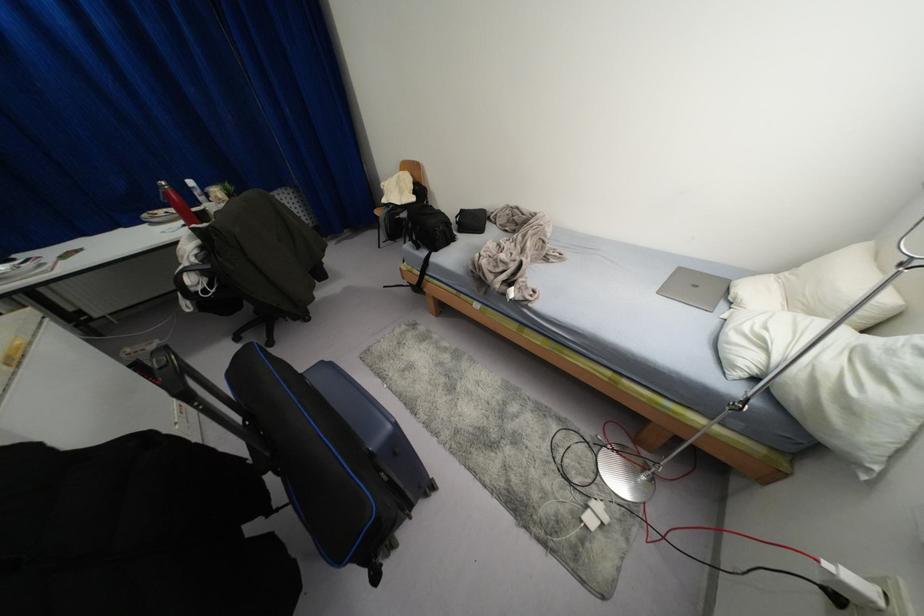
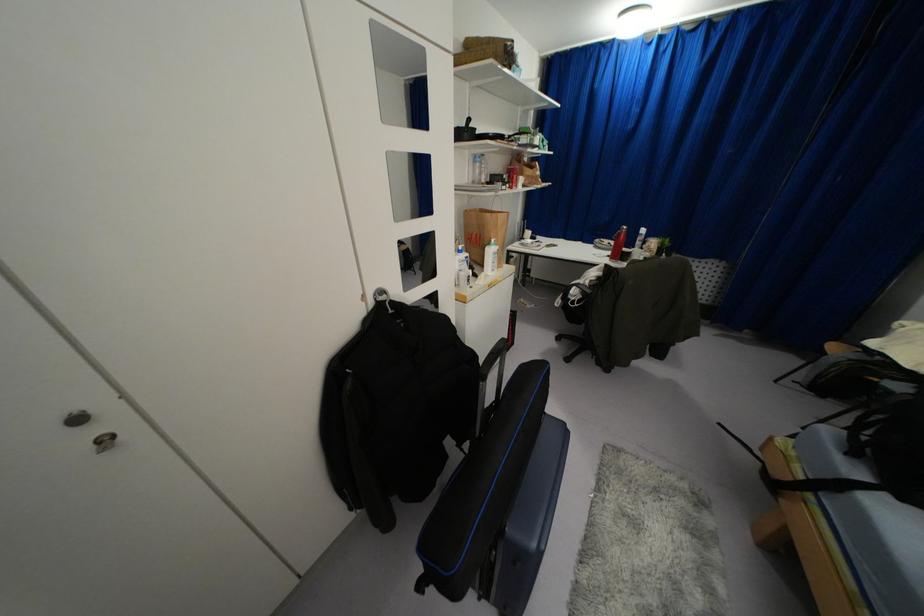
Looking at this image, the images are taken continuously from a first-person perspective. In which direction is your viewpoint rotating?

The camera's rotation is toward left-down.